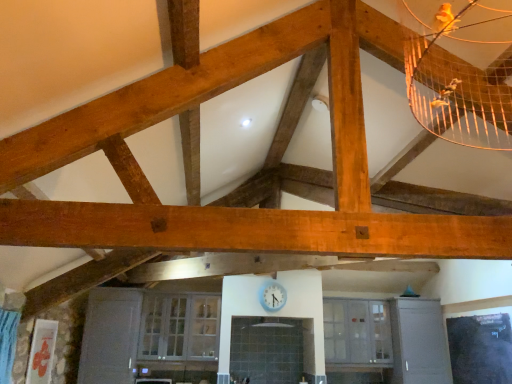
Question: Does clear glass cabinet at lower center, which is the first window in left-to-right order, touch clear glass cabinet at center, marked as the second window in a left-to-right arrangement?

Choices:
 (A) no
 (B) yes

Answer: (A)

Question: Is clear glass cabinet at lower center, the 2th window when ordered from right to left, wider than clear glass cabinet at center, marked as the second window in a left-to-right arrangement?

Choices:
 (A) no
 (B) yes

Answer: (B)

Question: From a real-world perspective, does clear glass cabinet at lower center, which is the first window in left-to-right order, stand above clear glass cabinet at center, which ranks as the first window in right-to-left order?

Choices:
 (A) no
 (B) yes

Answer: (A)

Question: Is clear glass cabinet at lower center, which is the first window in left-to-right order, far away from clear glass cabinet at center, which ranks as the first window in right-to-left order?

Choices:
 (A) no
 (B) yes

Answer: (B)

Question: Does clear glass cabinet at lower center, the 2th window when ordered from right to left, have a greater height compared to clear glass cabinet at center, which ranks as the first window in right-to-left order?

Choices:
 (A) yes
 (B) no

Answer: (A)

Question: Is clear glass cabinet at lower center, the 2th window when ordered from right to left, at the left side of clear glass cabinet at center, marked as the second window in a left-to-right arrangement?

Choices:
 (A) no
 (B) yes

Answer: (B)

Question: From a real-world perspective, is blue glossy clock at center beneath clear glass cabinet at center, marked as the second window in a left-to-right arrangement?

Choices:
 (A) no
 (B) yes

Answer: (A)

Question: Could you tell me if blue glossy clock at center is facing clear glass cabinet at center, which ranks as the first window in right-to-left order?

Choices:
 (A) yes
 (B) no

Answer: (B)

Question: Considering the relative sizes of blue glossy clock at center and clear glass cabinet at center, which ranks as the first window in right-to-left order, in the image provided, is blue glossy clock at center taller than clear glass cabinet at center, which ranks as the first window in right-to-left order,?

Choices:
 (A) no
 (B) yes

Answer: (A)

Question: Is blue glossy clock at center bigger than clear glass cabinet at center, marked as the second window in a left-to-right arrangement?

Choices:
 (A) yes
 (B) no

Answer: (B)

Question: Is blue glossy clock at center not near clear glass cabinet at center, which ranks as the first window in right-to-left order?

Choices:
 (A) no
 (B) yes

Answer: (B)

Question: From a real-world perspective, is blue glossy clock at center over clear glass cabinet at center, which ranks as the first window in right-to-left order?

Choices:
 (A) no
 (B) yes

Answer: (B)

Question: Is clear glass cabinet at center, which ranks as the first window in right-to-left order, surrounding clear glass cabinet at lower center, which is the first window in left-to-right order?

Choices:
 (A) yes
 (B) no

Answer: (B)